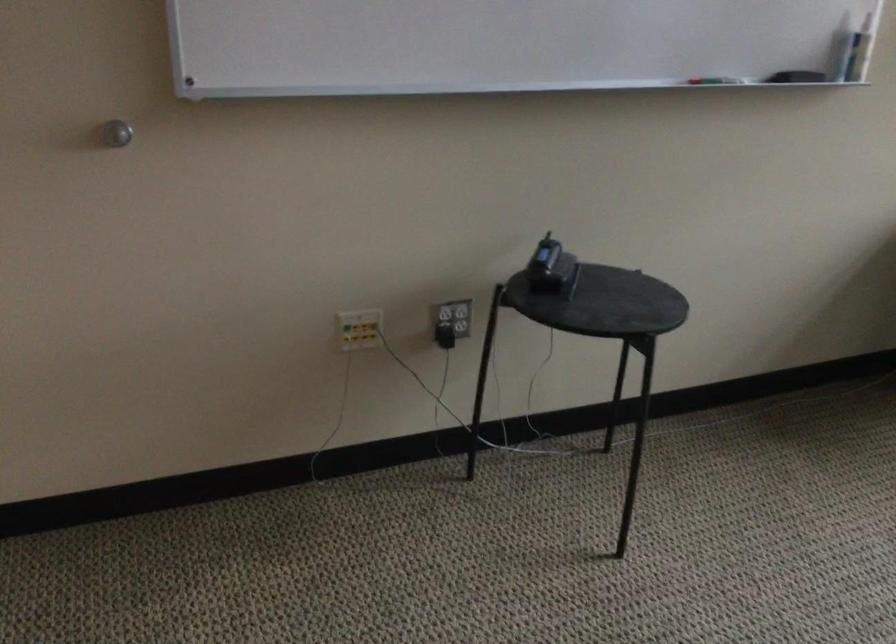
What are the coordinates of `black wall charger` in the screenshot? It's located at (444, 336).